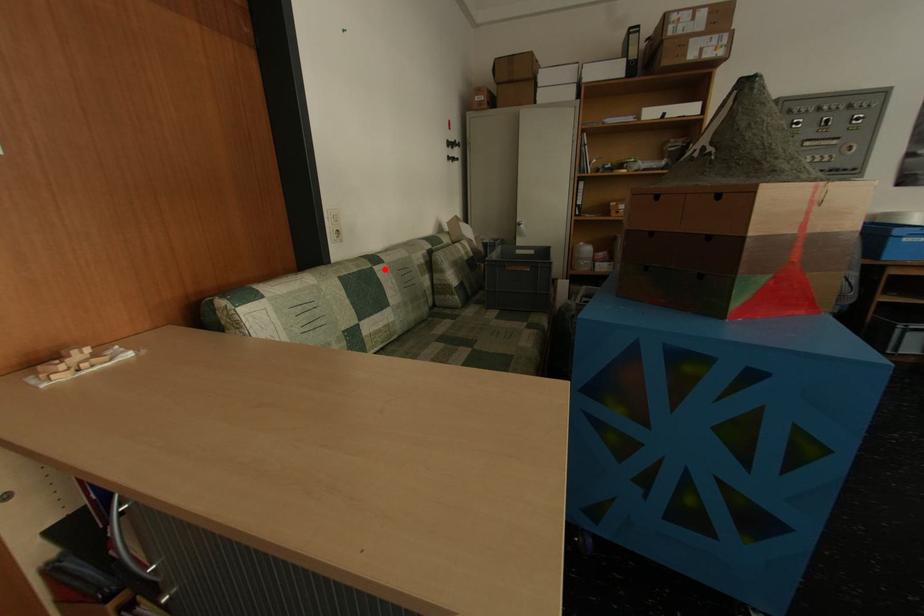
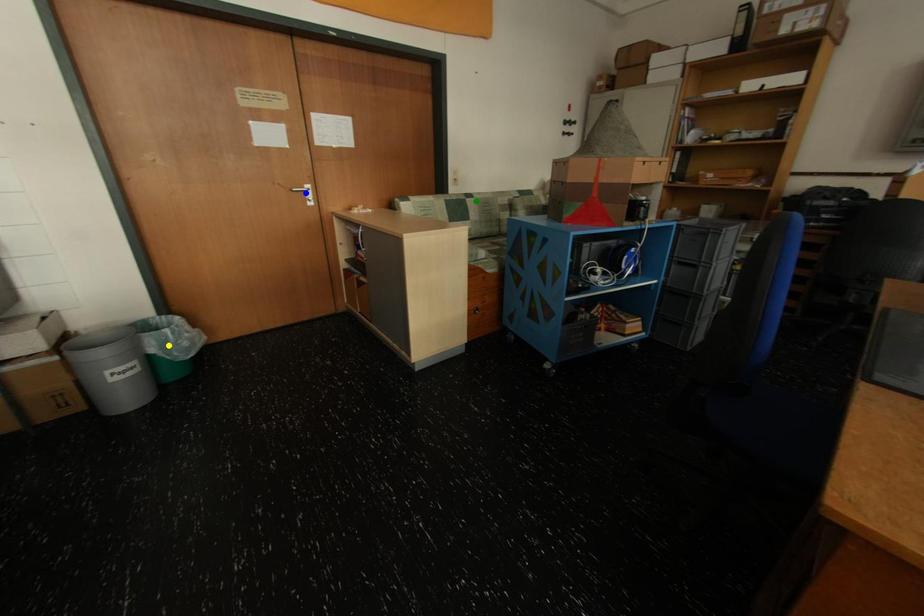
Question: I am providing you with two images of the same scene from different viewpoints. A red point is marked on the first image. You are given multiple points on the second image. Which point in image 2 represents the same 3d spot as the red point in image 1?

Choices:
 (A) green point
 (B) blue point
 (C) yellow point

Answer: (A)